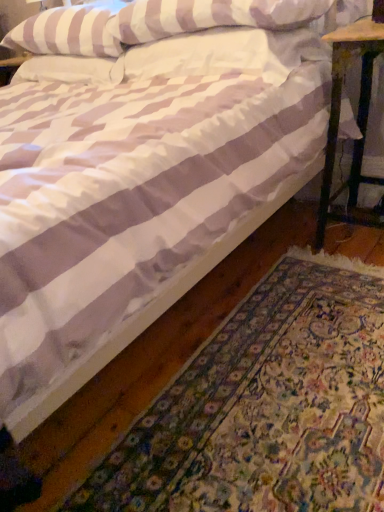
Question: Based on their sizes in the image, would you say white textured rug at lower right is bigger or smaller than wooden stool at right?

Choices:
 (A) small
 (B) big

Answer: (B)

Question: From the image's perspective, is white textured rug at lower right located above or below wooden stool at right?

Choices:
 (A) above
 (B) below

Answer: (B)

Question: Estimate the real-world distances between objects in this image. Which object is farther from the wooden stool at right?

Choices:
 (A) white textured rug at lower right
 (B) white striped pillow at upper center, placed as the 2th pillow when sorted from right to left
 (C) white striped pillow at upper left, the third pillow from the right
 (D) white striped pillow at upper center, placed as the 3th pillow when sorted from left to right

Answer: (C)

Question: Which is farther from the white striped pillow at upper center, arranged as the 2th pillow when viewed from the left?

Choices:
 (A) wooden stool at right
 (B) white striped pillow at upper center, which is the first pillow from right to left
 (C) white striped pillow at upper left, arranged as the 1th pillow when viewed from the left
 (D) white textured rug at lower right

Answer: (D)